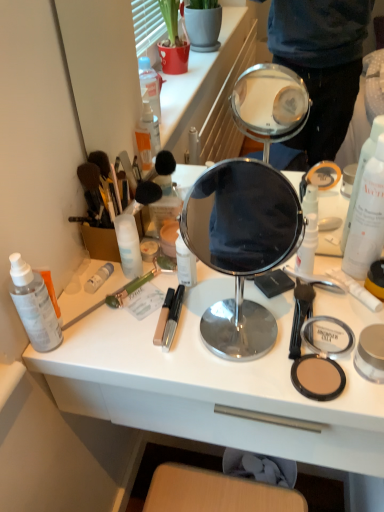
What are the coordinates of `vacant space in front of green plastic brush at lower left` in the screenshot? It's located at coord(111,348).